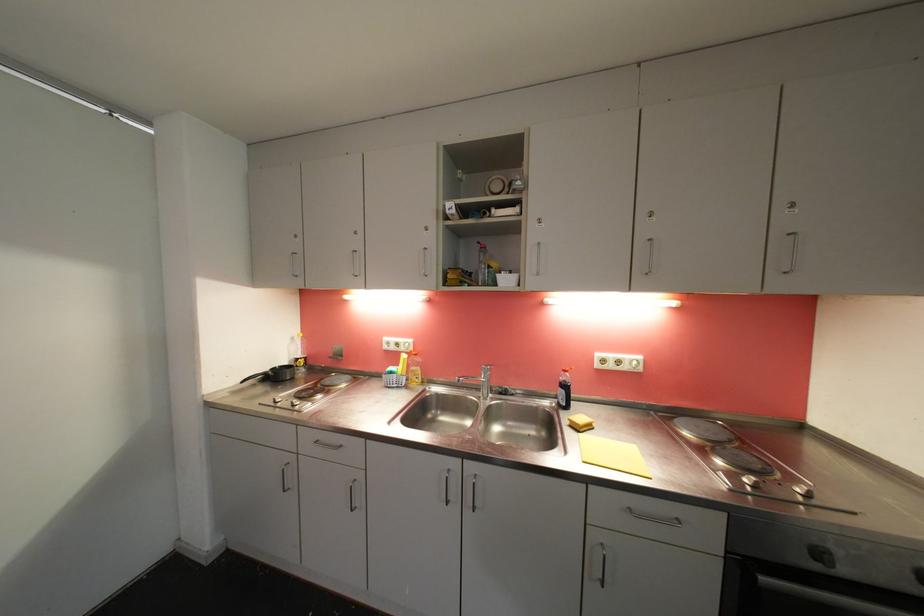
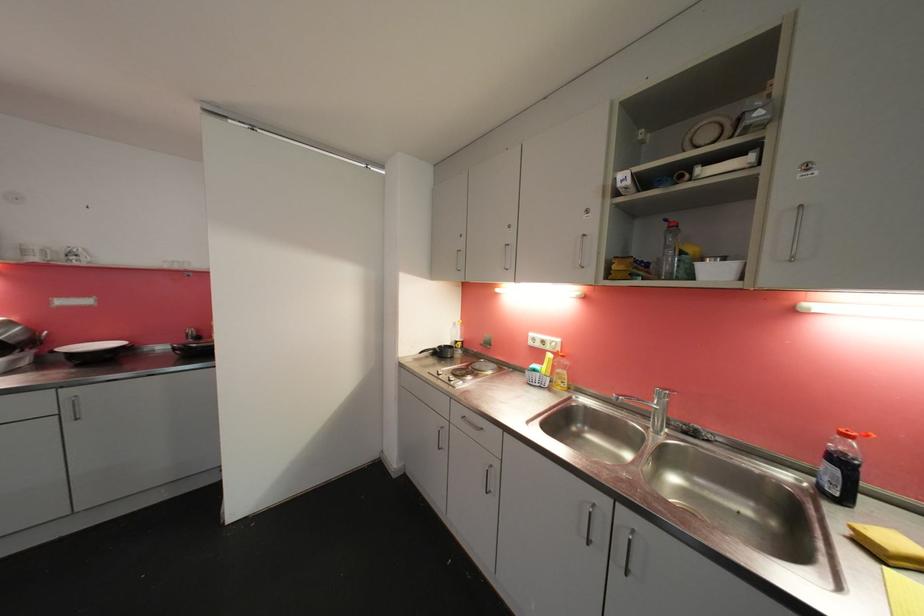
In the second image, find the point that corresponds to (503,278) in the first image.

(703, 267)